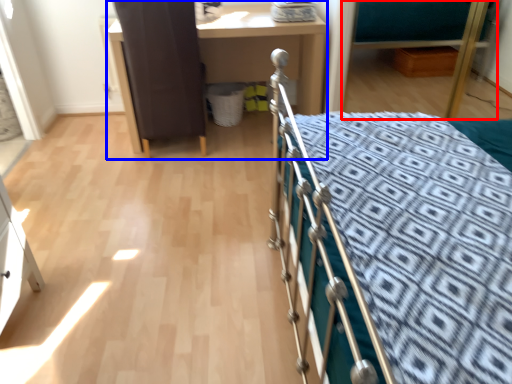
Question: Among these objects, which one is nearest to the camera, hospital bed (highlighted by a red box) or desk (highlighted by a blue box)?

Choices:
 (A) hospital bed
 (B) desk

Answer: (A)